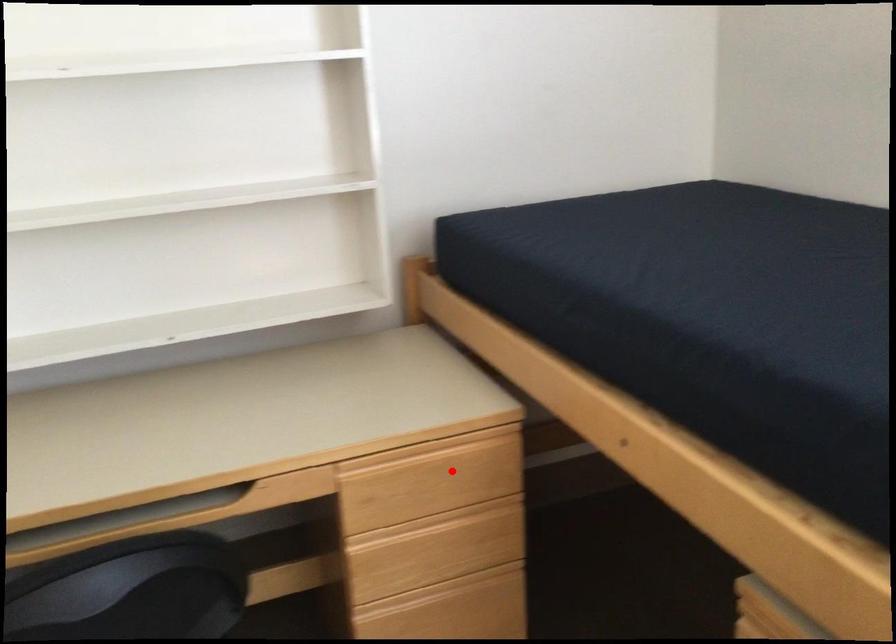
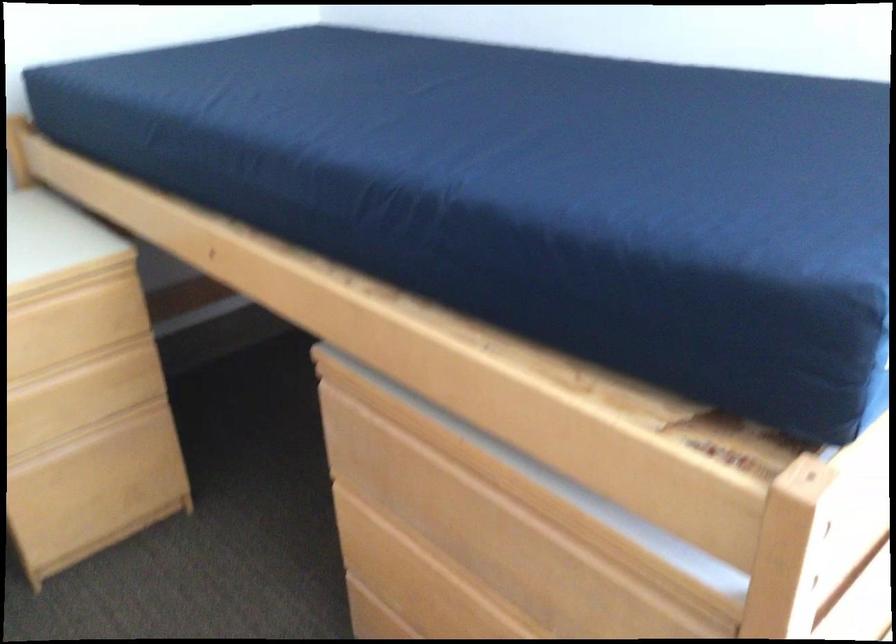
Locate, in the second image, the point that corresponds to the highlighted location in the first image.

(73, 323)